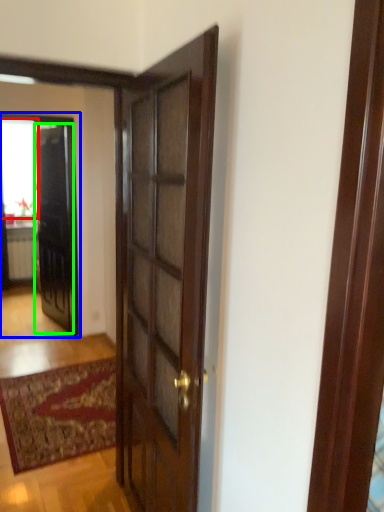
Question: Estimate the real-world distances between objects in this image. Which object is farther from window (highlighted by a red box), elevator (highlighted by a blue box) or door (highlighted by a green box)?

Choices:
 (A) elevator
 (B) door

Answer: (A)